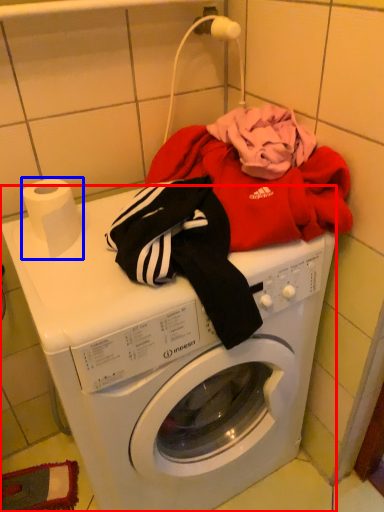
Question: Which object appears closest to the camera in this image, washing machine (highlighted by a red box) or toilet paper (highlighted by a blue box)?

Choices:
 (A) washing machine
 (B) toilet paper

Answer: (A)